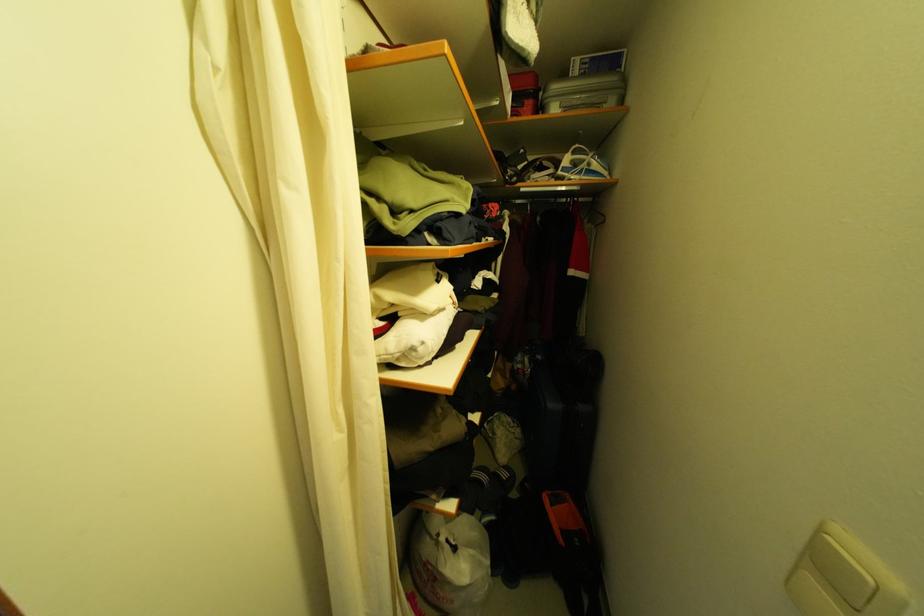
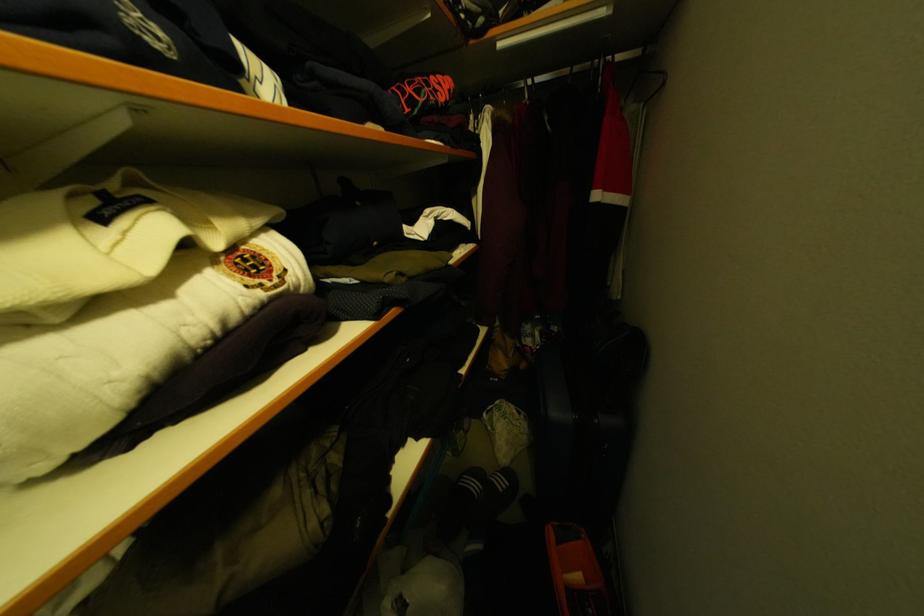
Question: Based on the continuous images, in which direction is the camera rotating? Reply with the corresponding letter.

Choices:
 (A) Left
 (B) Right
 (C) Up
 (D) Down

Answer: (D)